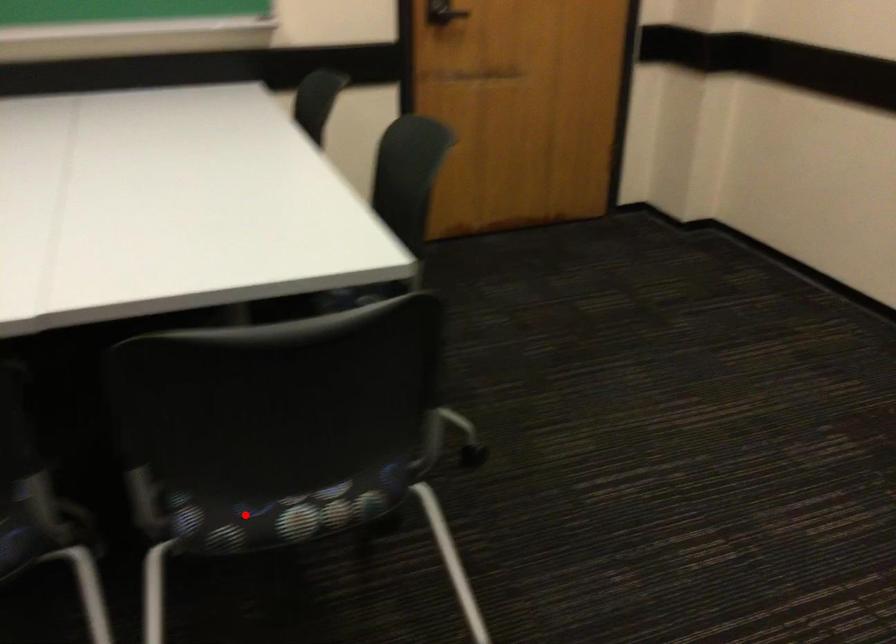
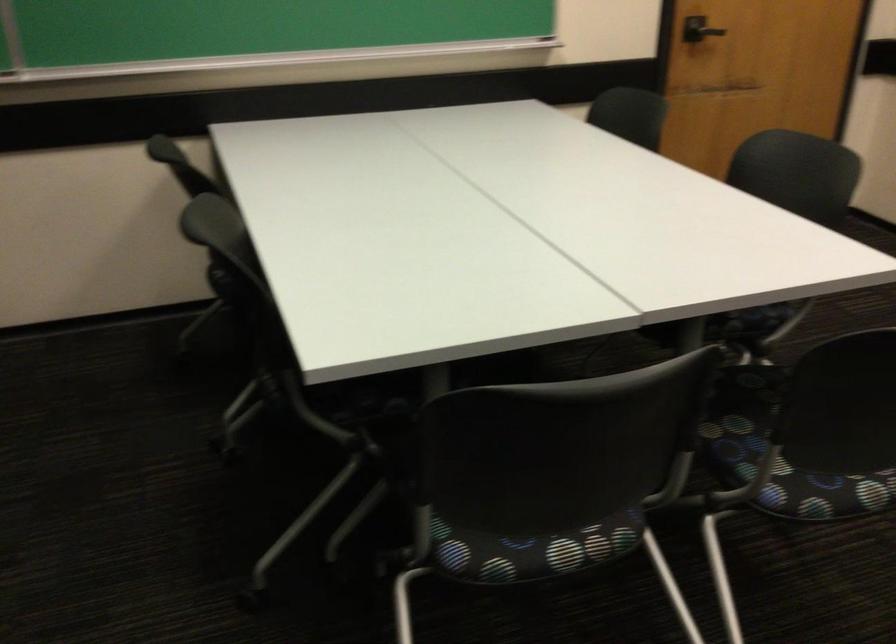
Question: I am providing you with two images of the same scene from different viewpoints. Image1 has a red point marked. In image2, the corresponding 3D location appears at what relative position? Reply with the corresponding letter.

Choices:
 (A) Closer
 (B) Farther

Answer: (B)